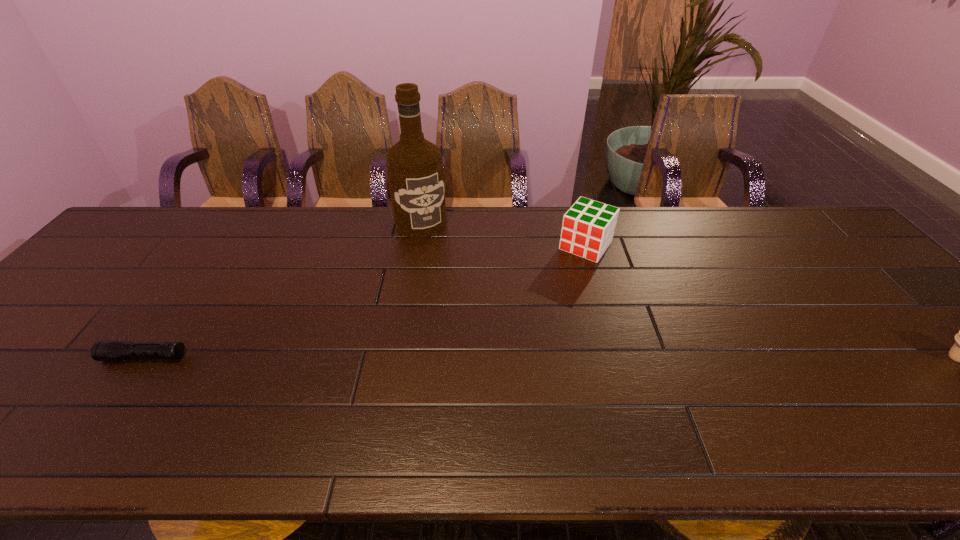
The image size is (960, 540). In order to click on vacant space located on the label of the tallest object in this screenshot , I will do coord(474,319).

Find the location of a particular element. vacant space located 0.300m on the label of the tallest object is located at coordinates (465, 301).

At what (x,y) coordinates should I click in order to perform the action: click on vacant space located on the red face of the third object from left to right. Please return your answer as a coordinate pair (x, y). The image size is (960, 540). Looking at the image, I should click on (557, 284).

You are a GUI agent. You are given a task and a screenshot of the screen. Output one action in this format:
    pyautogui.click(x=<x>, y=<y>)
    Task: Click on the free location located on the red face of the third object from left to right
    Image resolution: width=960 pixels, height=540 pixels.
    Given the screenshot: What is the action you would take?
    pyautogui.click(x=539, y=309)

In order to click on vacant area located 0.160m on the red face of the third object from left to right in this screenshot , I will do `click(550, 293)`.

This screenshot has width=960, height=540. I want to click on alcohol located in the far edge section of the desktop, so click(414, 165).

Identify the location of cube that is at the far edge. This screenshot has height=540, width=960. (588, 227).

The height and width of the screenshot is (540, 960). What are the coordinates of `free space at the far edge of the desktop` in the screenshot? It's located at (558, 210).

At what (x,y) coordinates should I click in order to perform the action: click on vacant space at the left edge. Please return your answer as a coordinate pair (x, y). This screenshot has height=540, width=960. Looking at the image, I should click on [x=60, y=359].

Find the location of a particular element. free space at the right edge of the desktop is located at coordinates (831, 278).